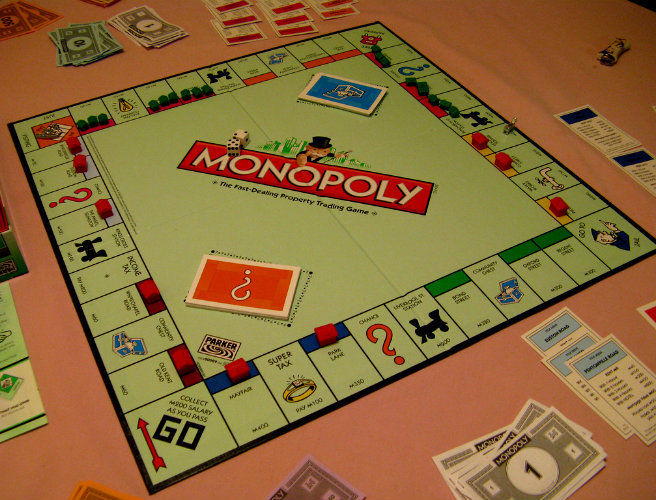
You are a GUI agent. You are given a task and a screenshot of the screen. Output one action in this format:
    pyautogui.click(x=<x>, y=<y>)
    Task: Click on the treasure chests
    This screenshot has width=656, height=500.
    Given the screenshot: What is the action you would take?
    pyautogui.click(x=124, y=348), pyautogui.click(x=516, y=289), pyautogui.click(x=344, y=89), pyautogui.click(x=276, y=59)